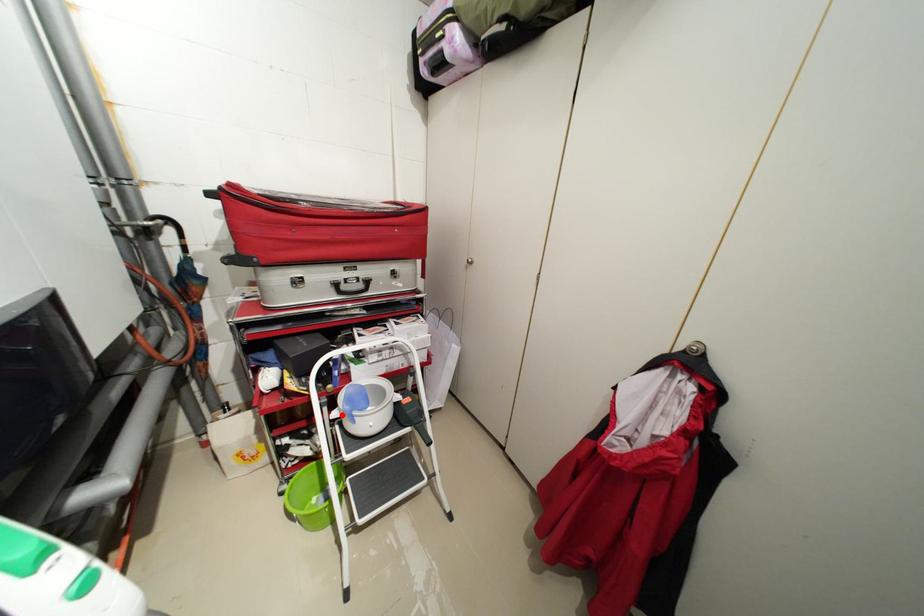
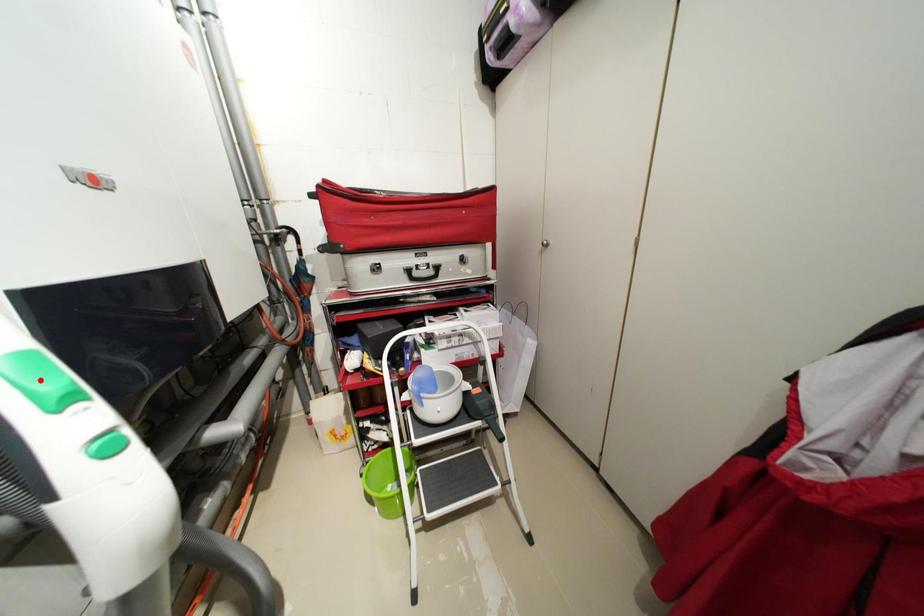
I am providing you with two images of the same scene from different viewpoints. A red point is marked on the first image and another point is marked on the second image. Are the points marked in image1 and image2 representing the same 3D position?

No